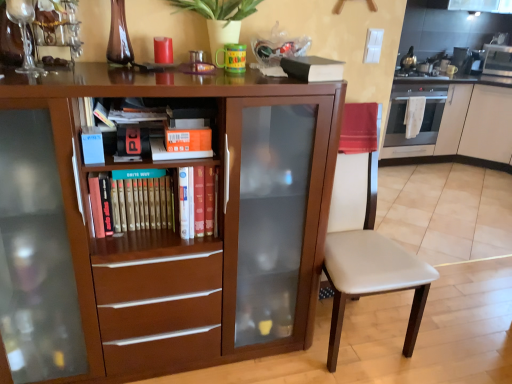
At what (x,y) coordinates should I click in order to perform the action: click on vacant region to the right of white leather chair at center. Please return your answer as a coordinate pair (x, y). Image resolution: width=512 pixels, height=384 pixels. Looking at the image, I should click on (443, 332).